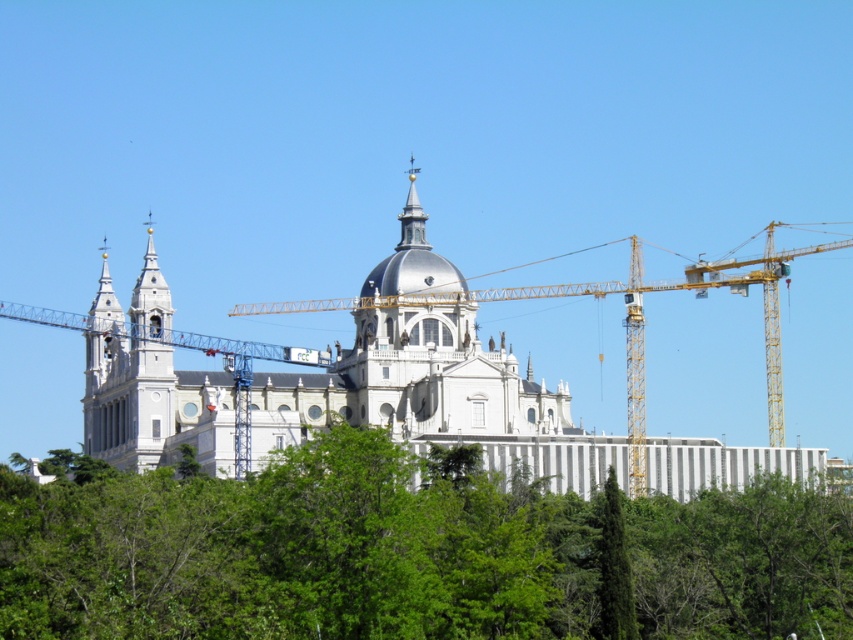
You are standing in front of a grand historic building with a dense tree canopy in the foreground. You notice a specific point marked at coordinates (436, 396). Based on the scene description, can you determine which part of the building this point corresponds to?

The point at coordinates (436, 396) is located on the white stone church at center.

You are a photographer planning to capture the full view of the polished silver spire at center without any obstruction from the green leafy tree at lower right. Based on the scene description, will you need to adjust your position to achieve this?

The green leafy tree at lower right has a lesser width compared to the polished silver spire at center. Since the tree is narrower, it might not fully block the spire if positioned to the side. Moving slightly to the left or right could position the tree so it only partially obscures the spire, but given the tree is at the lower right and the spire is centered, adjusting your angle or moving back to get a wider shot might help frame the spire without the tree blocking it. However, the exact adjustment would

Consider the image. You are standing in front of the cathedral and notice a specific point marked at coordinates (614, 570). Based on the scene description, can you identify what this point is located on?

The point at coordinates (614, 570) is located on the green leafy tree at lower right.